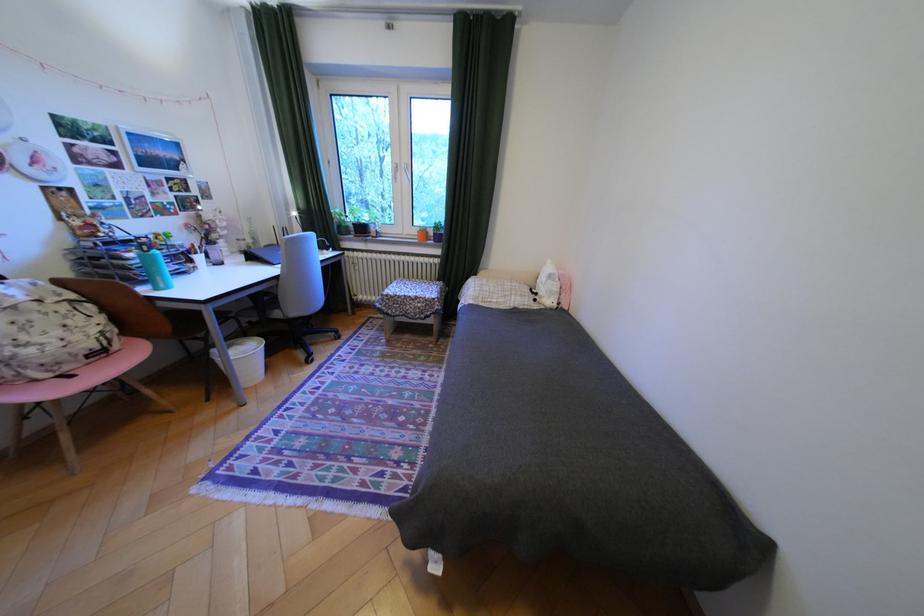
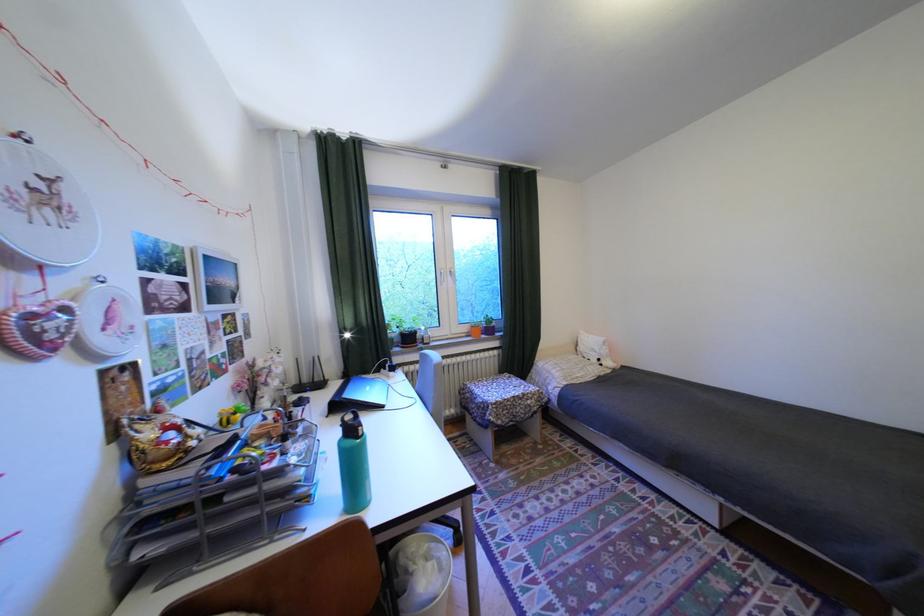
In the second image, find the point that corresponds to (347,209) in the first image.

(397, 322)